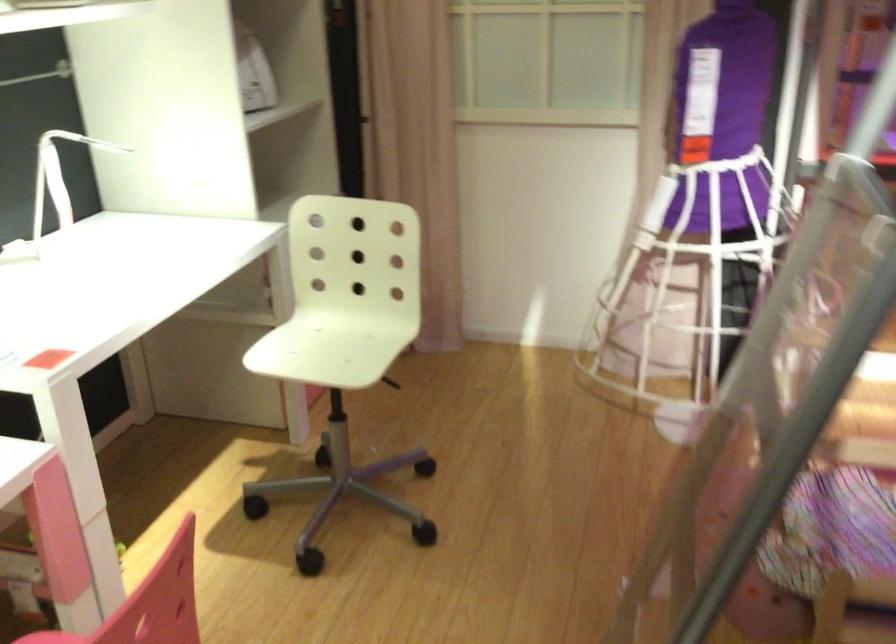
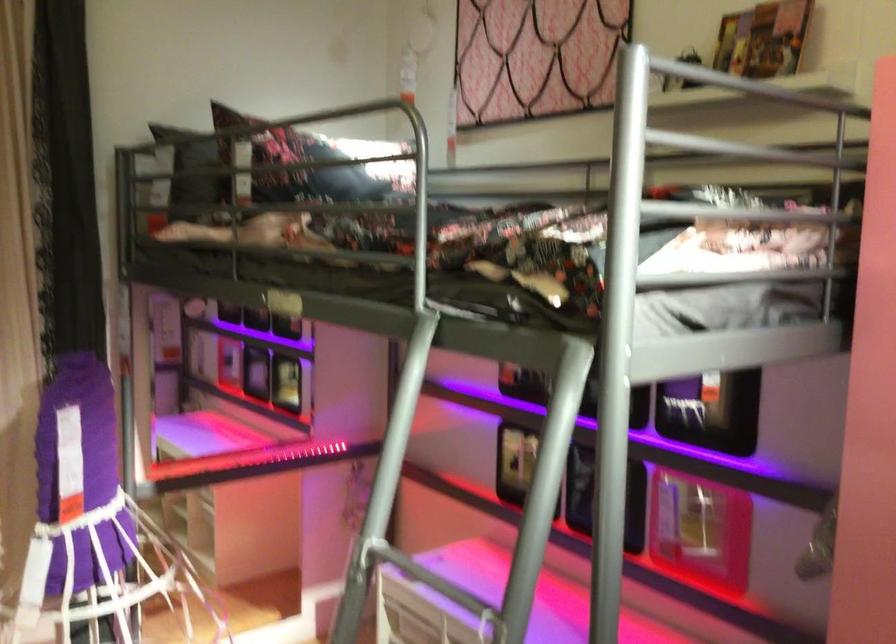
Question: The camera is either moving clockwise (left) or counter-clockwise (right) around the object. The first image is from the beginning of the video and the second image is from the end. Is the camera moving left or right when shooting the video?

Choices:
 (A) Left
 (B) Right

Answer: (A)